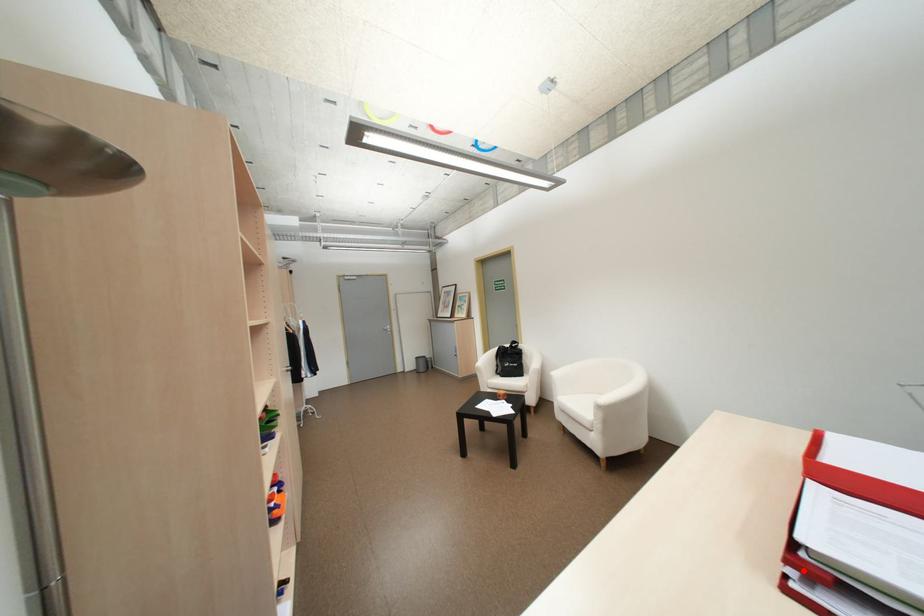
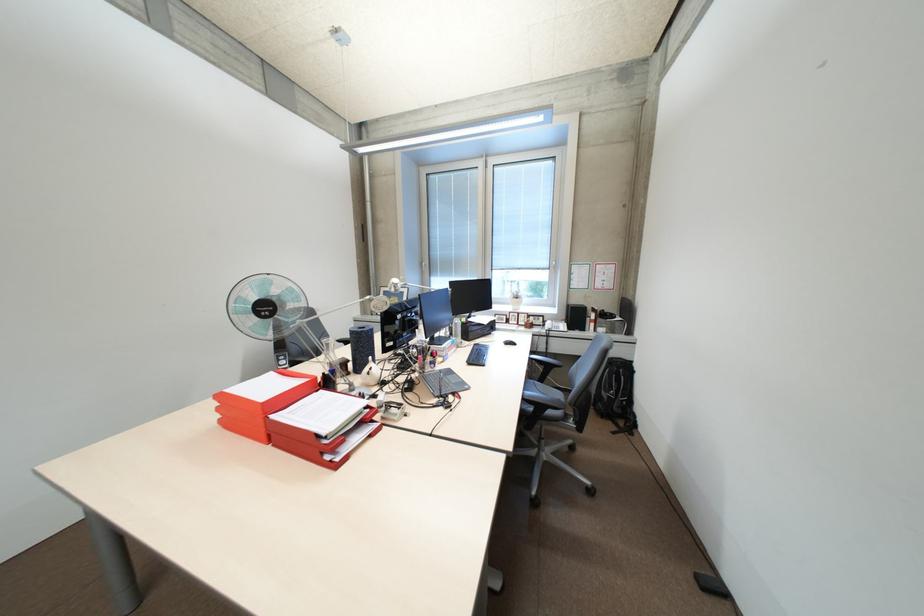
Find the pixel in the second image that matches the highlighted location in the first image.

(337, 456)